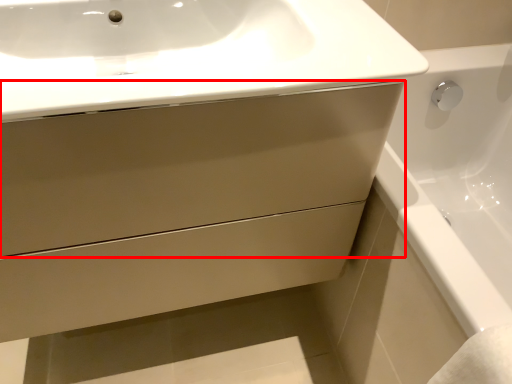
Question: From the image's perspective, where is drawer (annotated by the red box) located in relation to sink in the image?

Choices:
 (A) below
 (B) above

Answer: (A)